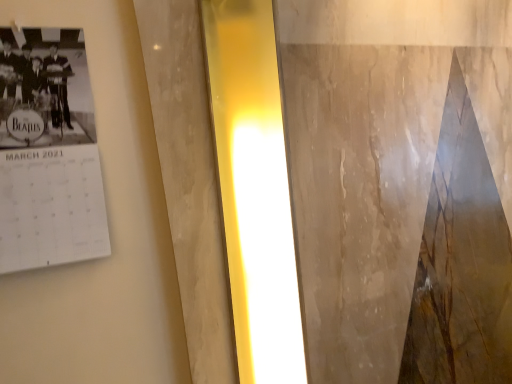
At what (x,y) coordinates should I click in order to perform the action: click on white paper calendar at upper left. Please return your answer as a coordinate pair (x, y). The height and width of the screenshot is (384, 512). Looking at the image, I should click on click(48, 152).

Describe the element at coordinates (48, 152) in the screenshot. I see `white paper calendar at upper left` at that location.

At what (x,y) coordinates should I click in order to perform the action: click on white paper calendar at upper left. Please return your answer as a coordinate pair (x, y). This screenshot has width=512, height=384. Looking at the image, I should click on (48, 152).